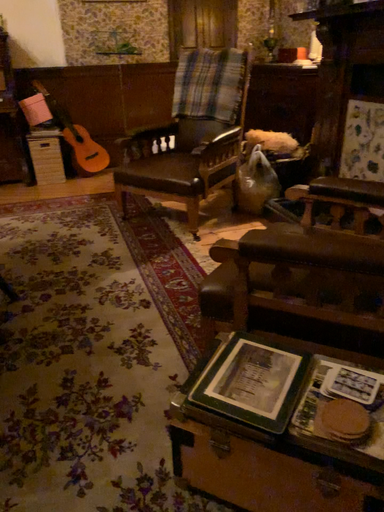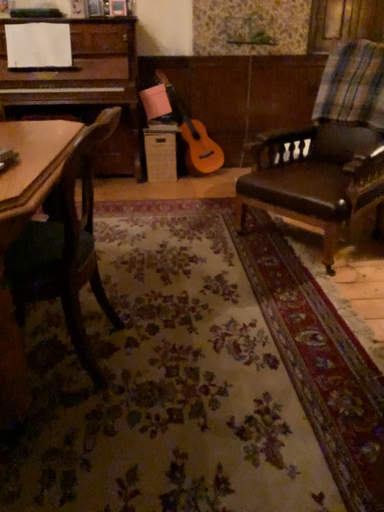
Question: Which way did the camera rotate in the video?

Choices:
 (A) rotated left
 (B) rotated right

Answer: (A)